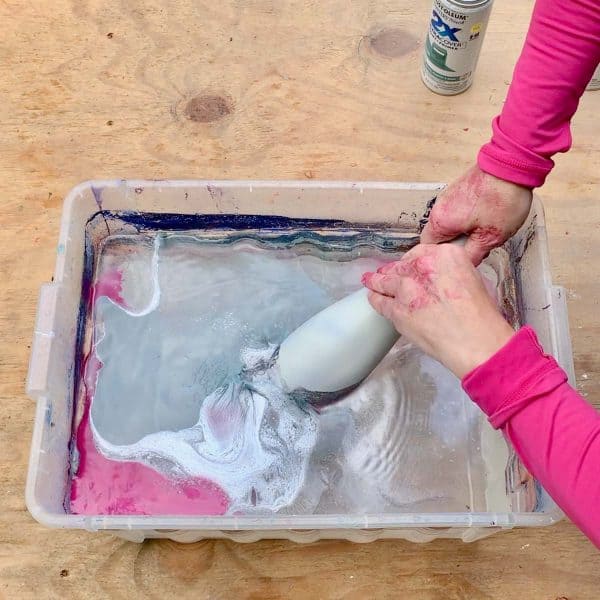
Where is `blue paint`? Image resolution: width=600 pixels, height=600 pixels. blue paint is located at coordinates (288, 236).